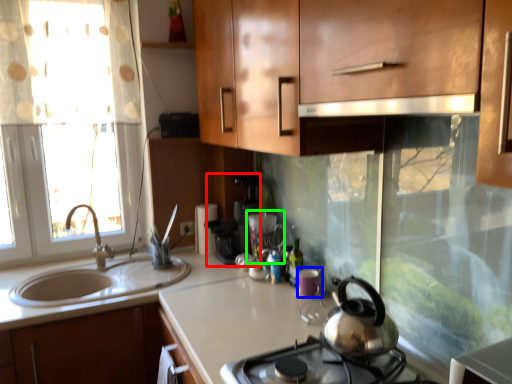
Question: Which is farther away from coffee machine (highlighted by a red box)? appliance (highlighted by a blue box) or appliance (highlighted by a green box)?

Choices:
 (A) appliance
 (B) appliance

Answer: (A)